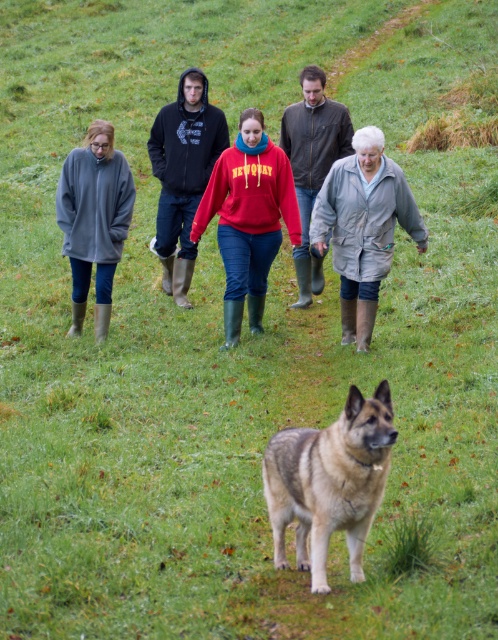
You are standing at the camera position and want to throw a ball to someone wearing the red fleece sweatshirt at center. If the ball travels in a straight line, will it pass over the dog in the foreground?

The distance between the red fleece sweatshirt at center and the camera is 9.78 meters. Since the dog is in the foreground, it is closer to the camera than the sweatshirt. Therefore, the ball thrown from the camera position to the sweatshirt will pass over the dog.